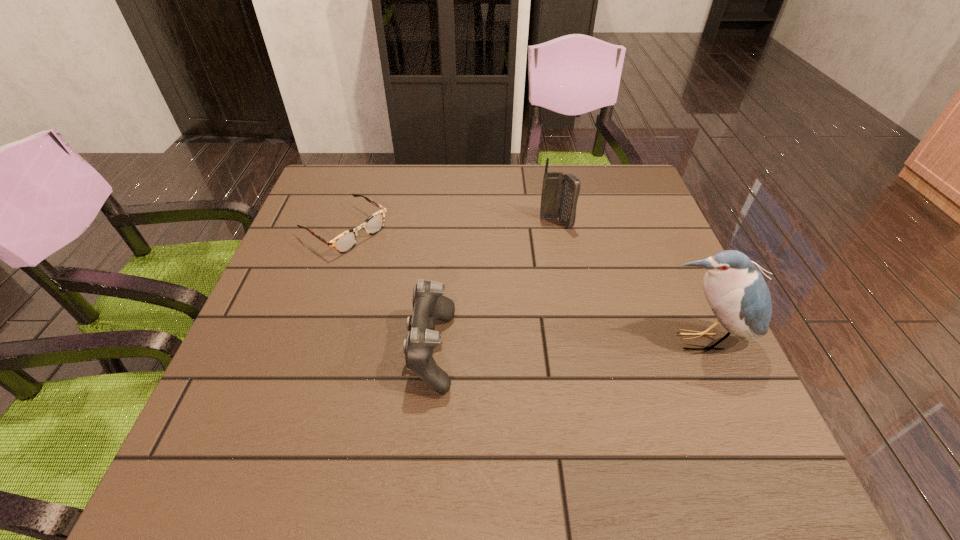
The height and width of the screenshot is (540, 960). I want to click on the third object from right to left, so click(429, 304).

At what (x,y) coordinates should I click in order to perform the action: click on control. Please return your answer as a coordinate pair (x, y). This screenshot has height=540, width=960. Looking at the image, I should click on (429, 304).

Identify the location of the tallest object. The width and height of the screenshot is (960, 540). (737, 293).

Locate an element on the screen. The width and height of the screenshot is (960, 540). bird is located at coordinates (737, 293).

Where is `the leftmost object`? The width and height of the screenshot is (960, 540). the leftmost object is located at coordinates (346, 241).

Where is `the shortest object`? The height and width of the screenshot is (540, 960). the shortest object is located at coordinates (346, 241).

This screenshot has height=540, width=960. Identify the location of the second object from right to left. (560, 192).

Where is `cellular telephone`? This screenshot has height=540, width=960. cellular telephone is located at coordinates [560, 192].

Where is `vacant region located on the surface of the second object from left to right with buttons`? Image resolution: width=960 pixels, height=540 pixels. vacant region located on the surface of the second object from left to right with buttons is located at coordinates (267, 350).

This screenshot has width=960, height=540. I want to click on vacant space located on the surface of the second object from left to right with buttons, so tap(307, 350).